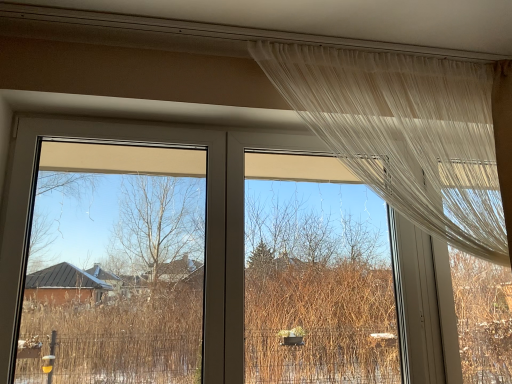
Question: Based on their sizes in the image, would you say sheer white curtain at upper right is bigger or smaller than transparent fabric at upper center, placed as the second window screen when sorted from left to right?

Choices:
 (A) small
 (B) big

Answer: (B)

Question: In terms of width, does sheer white curtain at upper right look wider or thinner when compared to transparent fabric at upper center, positioned as the 1th window screen in right-to-left order?

Choices:
 (A) wide
 (B) thin

Answer: (A)

Question: Estimate the real-world distances between objects in this image. Which object is closer to the transparent plastic window screen at left, the 2th window screen positioned from the right?

Choices:
 (A) transparent fabric at upper center, placed as the second window screen when sorted from left to right
 (B) sheer white curtain at upper right

Answer: (A)

Question: Which object is positioned farthest from the sheer white curtain at upper right?

Choices:
 (A) transparent plastic window screen at left, which is the first window screen in left-to-right order
 (B) transparent fabric at upper center, placed as the second window screen when sorted from left to right

Answer: (A)